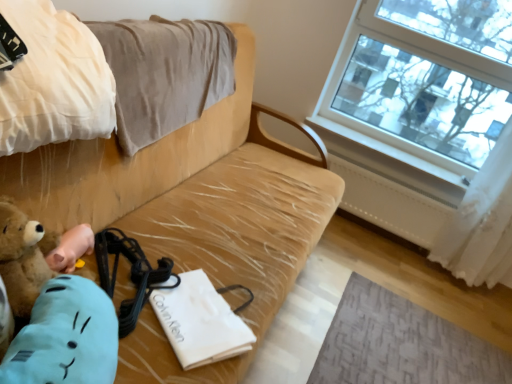
The image size is (512, 384). Find the location of `free spot in front of white sheer curtain at right`. free spot in front of white sheer curtain at right is located at coordinates (463, 303).